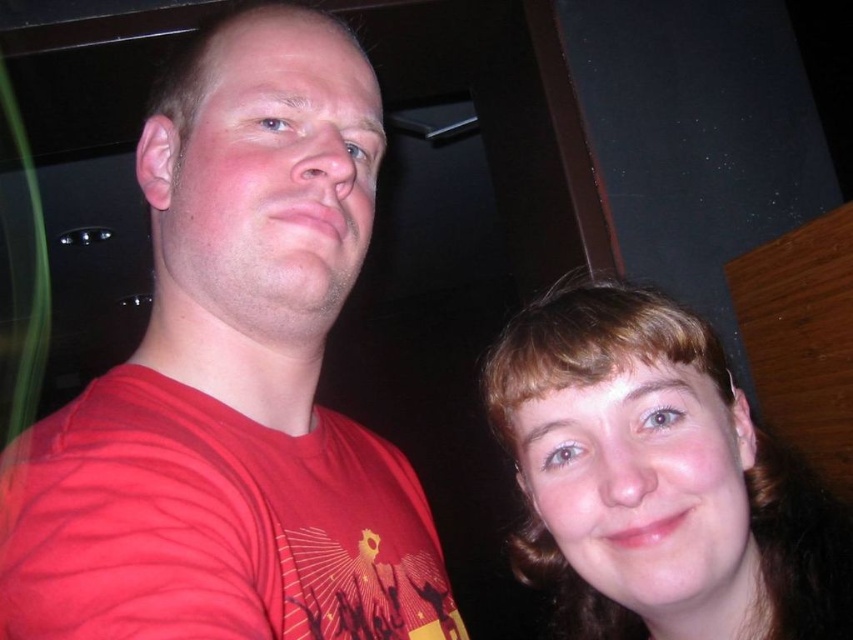
Question: Can you confirm if matte red t-shirt at left is bigger than brown hair at upper right?

Choices:
 (A) no
 (B) yes

Answer: (A)

Question: Which object appears farthest from the camera in this image?

Choices:
 (A) brown hair at upper right
 (B) matte red t-shirt at left

Answer: (A)

Question: Can you confirm if matte red t-shirt at left is wider than brown hair at upper right?

Choices:
 (A) yes
 (B) no

Answer: (B)

Question: Is matte red t-shirt at left above brown hair at upper right?

Choices:
 (A) no
 (B) yes

Answer: (B)